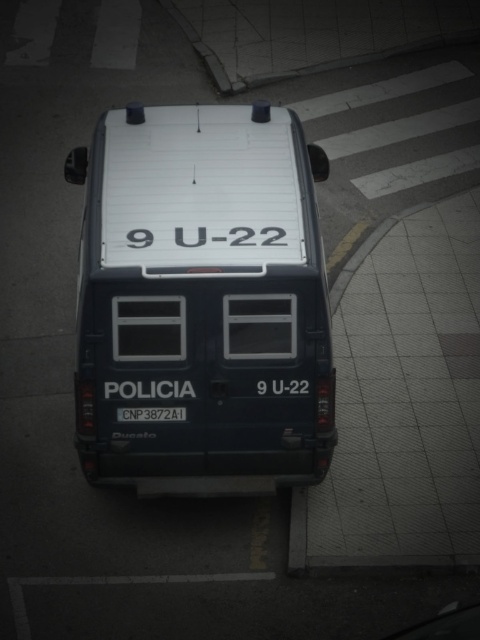
You are a pedestrian standing at the pedestrian crossing where the police van is parked. You notice a specific point marked at coordinates (202, 304). Based on the scene, can you determine which object this point corresponds to?

The point at coordinates (202, 304) is located on the dark blue matte van at center.

You are a delivery person standing 1 meter away from the dark blue matte van at center. You need to hand over a package to the police officer who is at the white plastic text at center. Can you reach the officer without moving closer than 1 meter from the van?

The dark blue matte van at center is 83.37 centimeters away from the white plastic text at center. Since you are already 1 meter away from the van, the total distance to the officer would be 1 meter plus 83.37 centimeters, which is 1.83 meters. Therefore, you cannot reach the officer without moving closer.